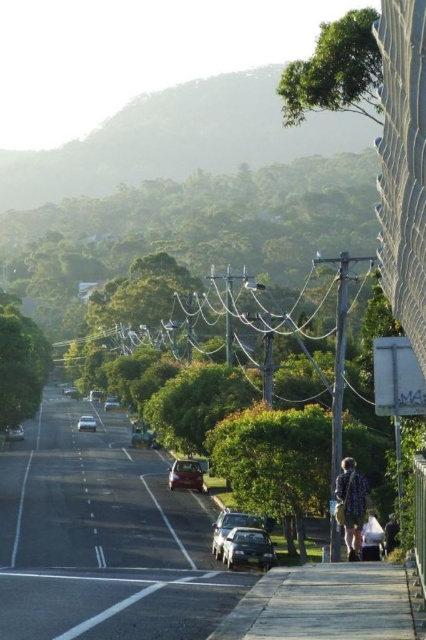
Question: Considering the real-world distances, which object is farthest from the shiny silver sedan at lower left?

Choices:
 (A) dark blue jeans at lower right
 (B) metallic silver sedan at center

Answer: (A)

Question: Is black asphalt road at center bigger than shiny black car at center?

Choices:
 (A) yes
 (B) no

Answer: (A)

Question: Based on their relative distances, which object is farther from the satin silver suv at lower center?

Choices:
 (A) black asphalt road at center
 (B) shiny black car at center

Answer: (A)

Question: Which object is positioned closest to the green leafy tree at upper right?

Choices:
 (A) shiny black car at center
 (B) dark blue jeans at lower right

Answer: (A)

Question: Is green leafy tree at left above shiny black car at center?

Choices:
 (A) yes
 (B) no

Answer: (A)

Question: Can you confirm if flannel shirt at right is wider than white cotton shirt at lower right?

Choices:
 (A) yes
 (B) no

Answer: (B)